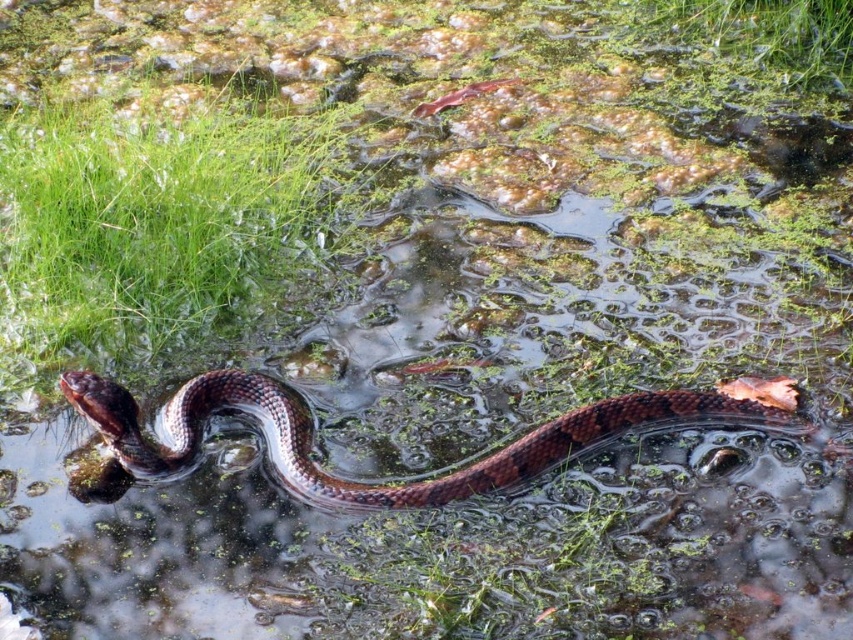
Question: Where is green grass at left located in relation to green matte grass at upper center in the image?

Choices:
 (A) above
 (B) below

Answer: (B)

Question: Estimate the real-world distances between objects in this image. Which object is farther from the green grass at left?

Choices:
 (A) green matte grass at upper center
 (B) shiny brown snake at center

Answer: (A)

Question: Is green grass at left bigger than green matte grass at upper center?

Choices:
 (A) yes
 (B) no

Answer: (A)

Question: Which point appears closest to the camera in this image?

Choices:
 (A) (741, 17)
 (B) (450, 492)

Answer: (B)

Question: Is the position of shiny brown snake at center less distant than that of green matte grass at upper center?

Choices:
 (A) yes
 (B) no

Answer: (A)

Question: Which point is farther from the camera taking this photo?

Choices:
 (A) (173, 444)
 (B) (27, 182)

Answer: (B)